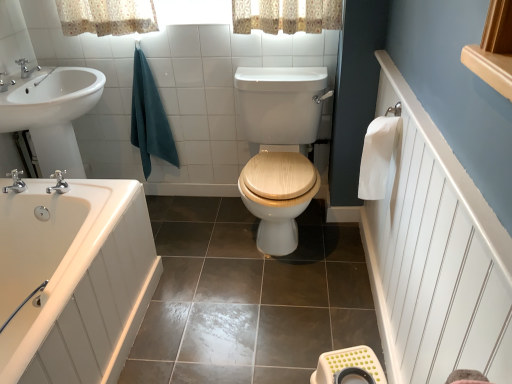
You are a GUI agent. You are given a task and a screenshot of the screen. Output one action in this format:
    pyautogui.click(x=<x>, y=<y>)
    Task: Click on the free region under wooden at center (from a real-world perspective)
    The width and height of the screenshot is (512, 384).
    Given the screenshot: What is the action you would take?
    pyautogui.click(x=282, y=253)